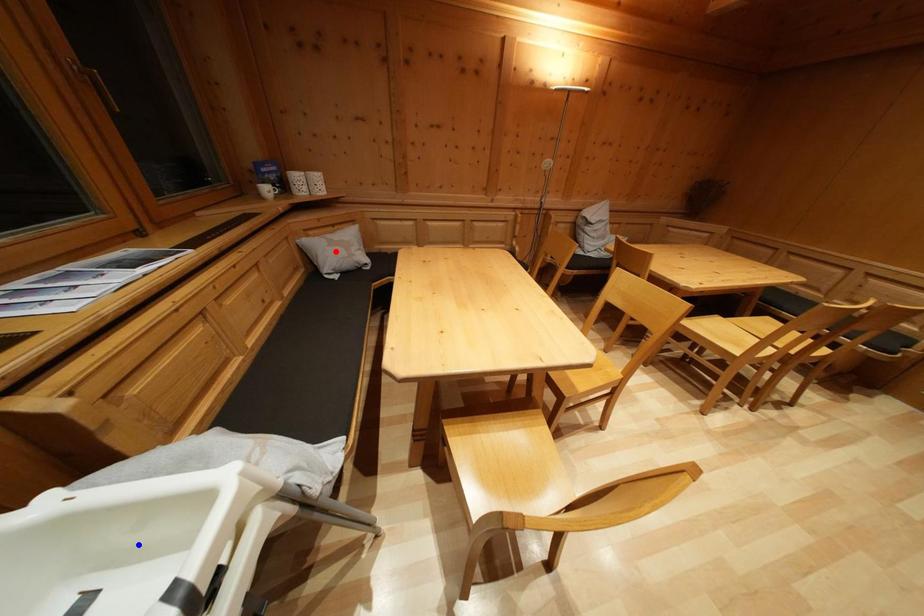
Question: Which of the two points in the image is closer to the camera?

Choices:
 (A) Blue point is closer.
 (B) Red point is closer.

Answer: (A)